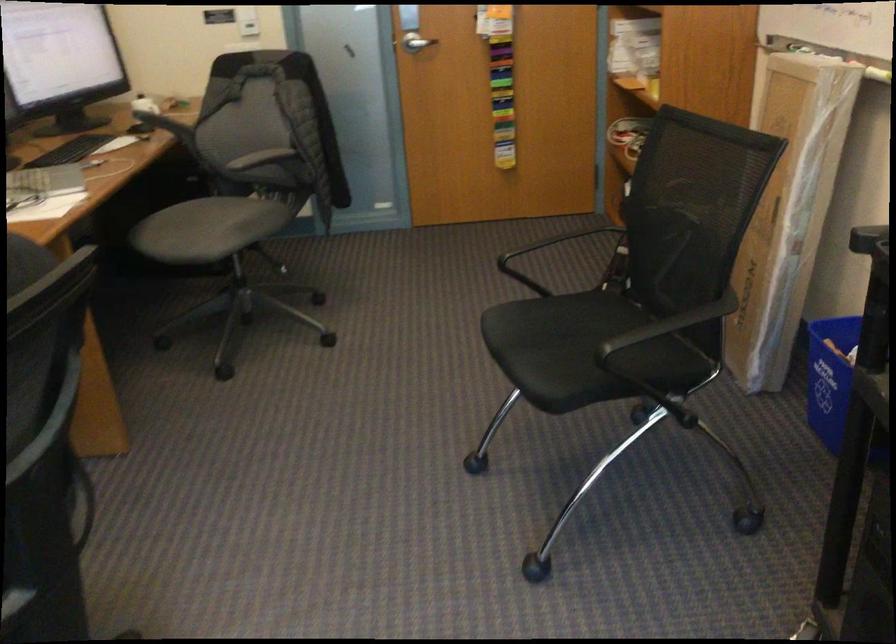
Where would you sit the chair sitting surface? Please return your answer as a coordinate pair (x, y).

(207, 229)